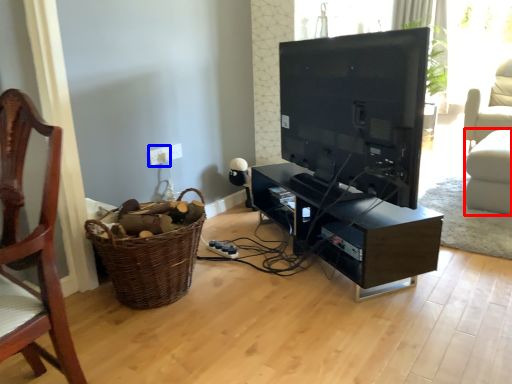
Question: Which point is closer to the camera, swivel chair (highlighted by a red box) or electric outlet (highlighted by a blue box)?

Choices:
 (A) swivel chair
 (B) electric outlet

Answer: (B)